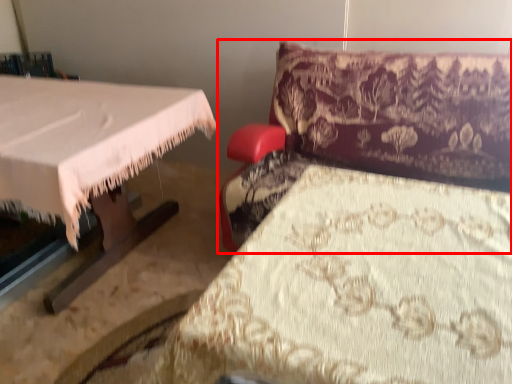
Question: From the image's perspective, what is the correct spatial positioning of furniture (annotated by the red box) in reference to sheet?

Choices:
 (A) below
 (B) above

Answer: (B)